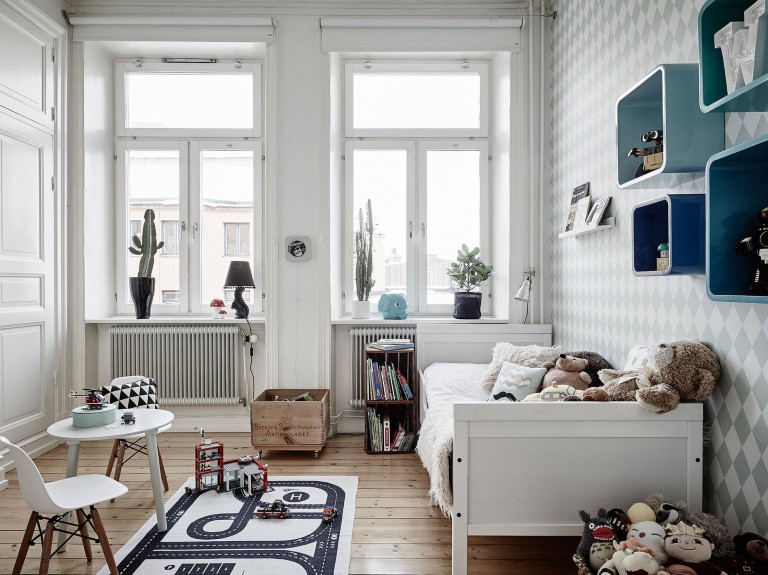
You are a GUI agent. You are given a task and a screenshot of the screen. Output one action in this format:
    pyautogui.click(x=<x>, y=<y>)
    Task: Click on the white wooden bed frame
    The image size is (768, 575).
    Given the screenshot: What is the action you would take?
    pyautogui.click(x=533, y=442), pyautogui.click(x=462, y=350)